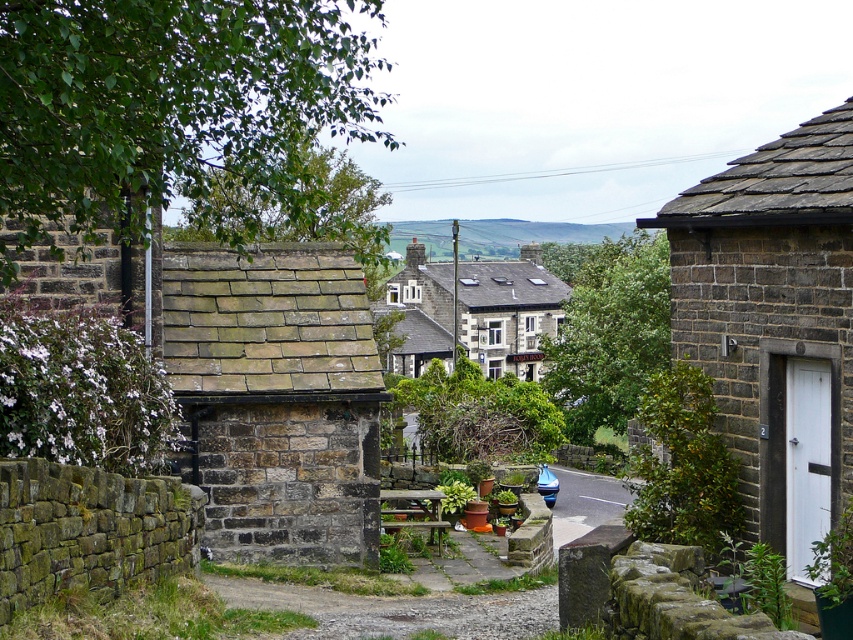
Between point (252, 461) and point (798, 168), which one is positioned in front?

Point (798, 168)

Can you confirm if rustic stone cottage at left is bigger than matte stone cottage at right?

Yes.

Who is more distant from viewer, (296, 312) or (773, 476)?

The point (296, 312) is more distant.

Identify the location of rustic stone cottage at left. This screenshot has width=853, height=640. (280, 369).

Between rustic stone cottage at left and dark gray stone cottage at center, which one has more height?

dark gray stone cottage at center

Can you confirm if rustic stone cottage at left is positioned above dark gray stone cottage at center?

Actually, rustic stone cottage at left is below dark gray stone cottage at center.

This screenshot has width=853, height=640. What are the coordinates of `rustic stone cottage at left` in the screenshot? It's located at (280, 369).

Image resolution: width=853 pixels, height=640 pixels. What do you see at coordinates (775, 323) in the screenshot?
I see `matte stone cottage at right` at bounding box center [775, 323].

Is matte stone cottage at right bigger than dark gray stone cottage at center?

Actually, matte stone cottage at right might be smaller than dark gray stone cottage at center.

The width and height of the screenshot is (853, 640). What do you see at coordinates (775, 323) in the screenshot?
I see `matte stone cottage at right` at bounding box center [775, 323].

This screenshot has height=640, width=853. I want to click on matte stone cottage at right, so click(775, 323).